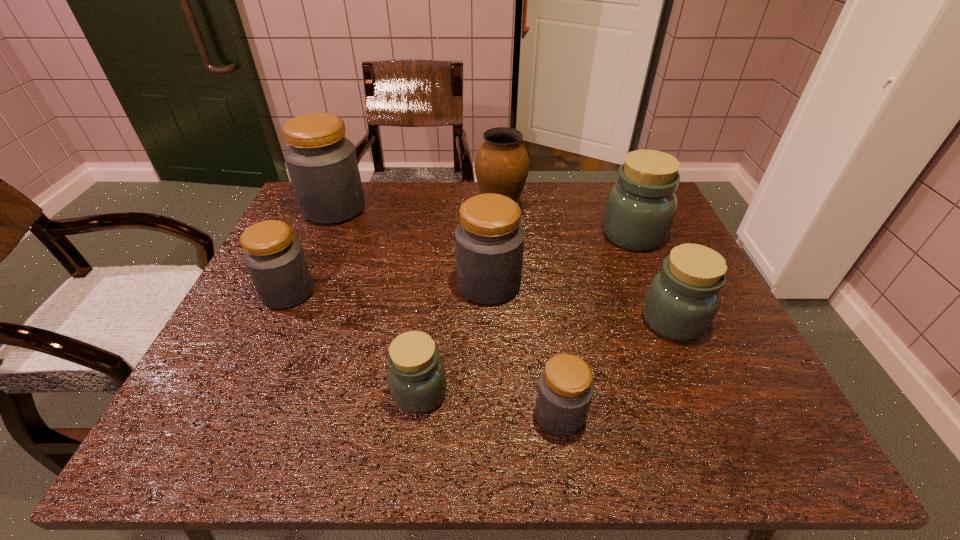
The width and height of the screenshot is (960, 540). Identify the location of the smallest gray jar. (565, 390).

Find the location of a particular element. the nearest gray jar is located at coordinates (565, 390).

The height and width of the screenshot is (540, 960). I want to click on free region located on the surface of the biggest gray jar near the warning symbol, so click(471, 208).

Image resolution: width=960 pixels, height=540 pixels. What are the coordinates of `free space located on the right of the urn` in the screenshot? It's located at (606, 212).

Where is `free space located on the front of the farthest green jar`? free space located on the front of the farthest green jar is located at coordinates (681, 347).

Where is `free region located 0.370m on the surface of the third gray jar from left to right near the warning symbol`? The width and height of the screenshot is (960, 540). free region located 0.370m on the surface of the third gray jar from left to right near the warning symbol is located at coordinates (306, 285).

Where is `vacant space located 0.300m on the surface of the third gray jar from left to right near the warning symbol`? vacant space located 0.300m on the surface of the third gray jar from left to right near the warning symbol is located at coordinates (335, 285).

Find the location of a particular element. free region located on the surface of the third gray jar from left to right near the warning symbol is located at coordinates (375, 285).

You are a GUI agent. You are given a task and a screenshot of the screen. Output one action in this format:
    pyautogui.click(x=<x>, y=<y>)
    Task: Click on the vacant region located on the surface of the third biggest gray jar near the warning symbol
    
    Given the screenshot: What is the action you would take?
    pyautogui.click(x=344, y=292)

The image size is (960, 540). What are the coordinates of `vacant position located on the back of the second biggest green jar` in the screenshot? It's located at (643, 253).